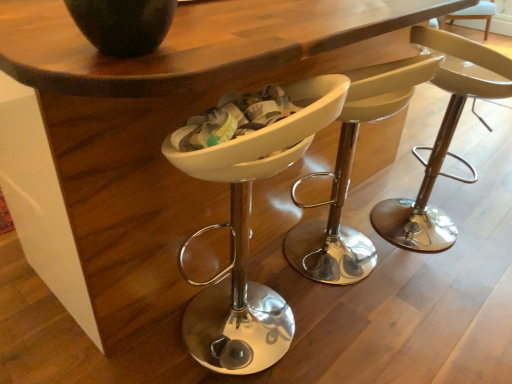
Find the location of a particular element. The height and width of the screenshot is (384, 512). free space in front of matte beige stool at center, which ranks as the first chair in right-to-left order is located at coordinates (444, 289).